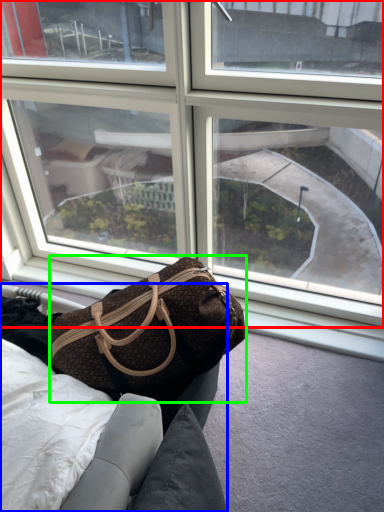
Question: Which object is the farthest from window (highlighted by a red box)? Choose among these: furniture (highlighted by a blue box) or handbag (highlighted by a green box).

Choices:
 (A) furniture
 (B) handbag

Answer: (A)